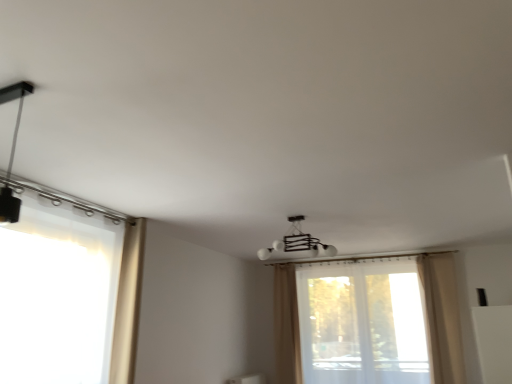
Question: Considering the relative positions of matte black track light at upper left, positioned as the 2th lamp in right-to-left order, and transparent fabric window at center, the first window viewed from the right, in the image provided, is matte black track light at upper left, positioned as the 2th lamp in right-to-left order, to the left or to the right of transparent fabric window at center, the first window viewed from the right,?

Choices:
 (A) left
 (B) right

Answer: (A)

Question: From the image's perspective, is matte black track light at upper left, which appears as the first lamp when viewed from the left, above or below transparent fabric window at center, which is the 2th window from front to back?

Choices:
 (A) above
 (B) below

Answer: (A)

Question: Based on their relative distances, which object is nearer to the white glossy chandelier at center, the 2th lamp viewed from the top?

Choices:
 (A) beige fabric curtain at left, which is the third curtain in right-to-left order
 (B) beige fabric curtain at center, which is the 2th curtain from right to left
 (C) transparent fabric window at center, which is the 2th window from front to back
 (D) translucent fabric window at left, placed as the 1th window when sorted from front to back
 (E) beige fabric curtain at right, placed as the 2th curtain when sorted from front to back

Answer: (B)

Question: Which object is positioned farthest from the matte black track light at upper left, which appears as the first lamp when viewed from the left?

Choices:
 (A) transparent fabric window at center, which appears as the 2th window when viewed from the left
 (B) beige fabric curtain at center, the third curtain when ordered from front to back
 (C) white glossy chandelier at center, the 2th lamp viewed from the top
 (D) beige fabric curtain at right, the 2th curtain in the back-to-front sequence
 (E) beige fabric curtain at left, which appears as the 3th curtain when viewed from the back

Answer: (B)